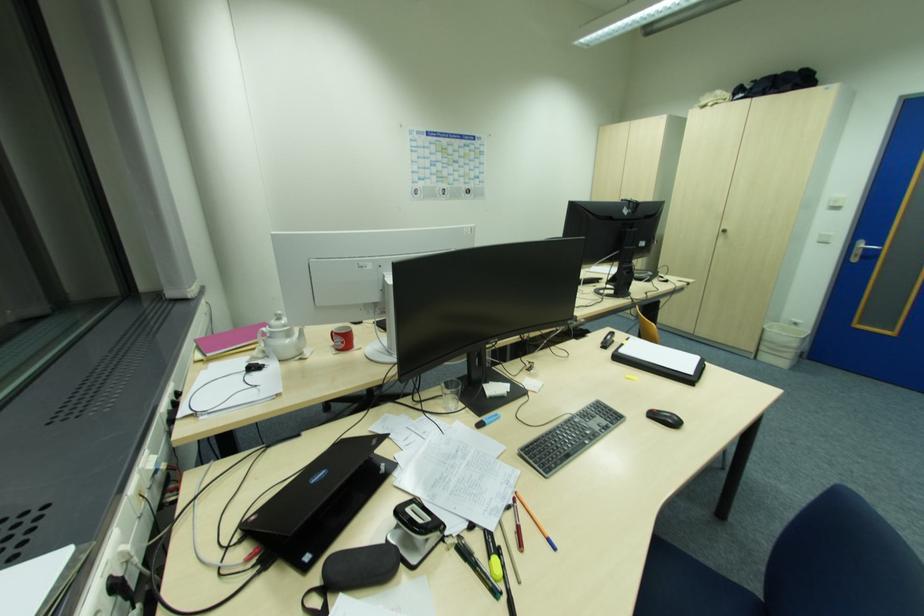
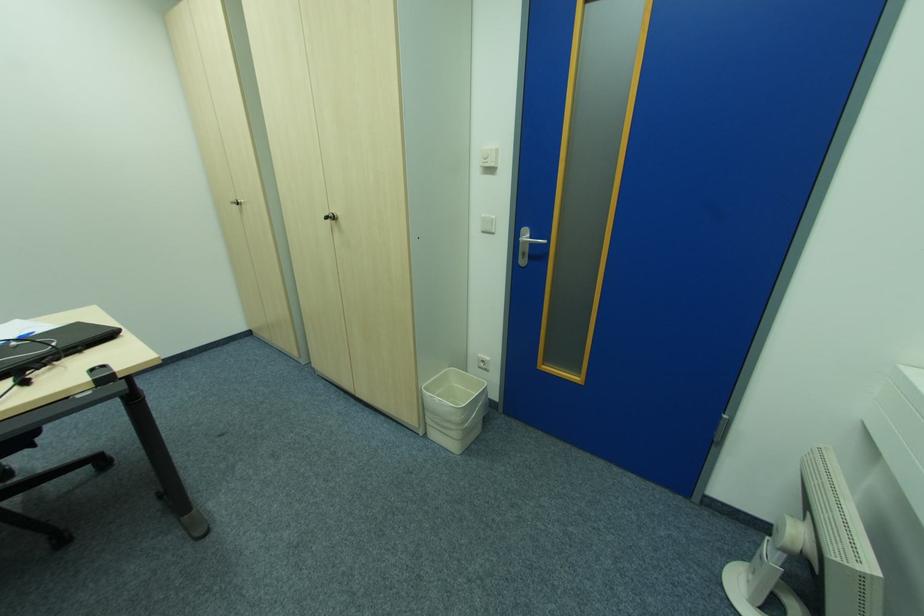
The point at (858, 256) is marked in the first image. Where is the corresponding point in the second image?

(526, 256)